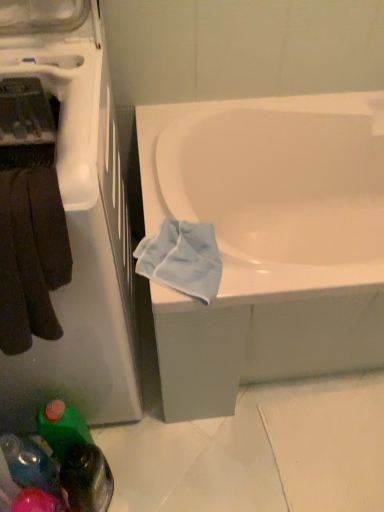
Question: Does light blue fabric at lower right have a smaller size compared to green plastic bottle at lower left, marked as the 1th bottle in a right-to-left arrangement?

Choices:
 (A) yes
 (B) no

Answer: (B)

Question: Does light blue fabric at lower right contain green plastic bottle at lower left, which appears as the second bottle when viewed from the left?

Choices:
 (A) yes
 (B) no

Answer: (B)

Question: From the image's perspective, is light blue fabric at lower right below green plastic bottle at lower left, which appears as the second bottle when viewed from the left?

Choices:
 (A) yes
 (B) no

Answer: (B)

Question: Considering the relative sizes of light blue fabric at lower right and green plastic bottle at lower left, which appears as the second bottle when viewed from the left, in the image provided, is light blue fabric at lower right wider than green plastic bottle at lower left, which appears as the second bottle when viewed from the left,?

Choices:
 (A) no
 (B) yes

Answer: (B)

Question: From a real-world perspective, is light blue fabric at lower right physically below green plastic bottle at lower left, marked as the 1th bottle in a right-to-left arrangement?

Choices:
 (A) no
 (B) yes

Answer: (A)

Question: Is point (36, 472) positioned closer to the camera than point (44, 437)?

Choices:
 (A) closer
 (B) farther

Answer: (A)

Question: Based on their sizes in the image, would you say translucent plastic bottle at lower left, marked as the 1th bottle in a left-to-right arrangement, is bigger or smaller than green plastic bottle at lower left, marked as the 1th bottle in a right-to-left arrangement?

Choices:
 (A) small
 (B) big

Answer: (A)

Question: Is translucent plastic bottle at lower left, placed as the 2th bottle when sorted from right to left, in front of or behind green plastic bottle at lower left, which appears as the second bottle when viewed from the left, in the image?

Choices:
 (A) behind
 (B) front

Answer: (B)

Question: Is translucent plastic bottle at lower left, marked as the 1th bottle in a left-to-right arrangement, to the left or to the right of green plastic bottle at lower left, marked as the 1th bottle in a right-to-left arrangement, in the image?

Choices:
 (A) left
 (B) right

Answer: (A)

Question: Which is correct: dark brown towel at left is inside white glossy dishwasher at left, or outside of it?

Choices:
 (A) outside
 (B) inside

Answer: (B)

Question: Considering the positions of dark brown towel at left and white glossy dishwasher at left in the image, is dark brown towel at left wider or thinner than white glossy dishwasher at left?

Choices:
 (A) thin
 (B) wide

Answer: (A)

Question: Relative to white glossy dishwasher at left, is dark brown towel at left in front or behind?

Choices:
 (A) behind
 (B) front

Answer: (A)

Question: In terms of height, does dark brown towel at left look taller or shorter compared to white glossy dishwasher at left?

Choices:
 (A) tall
 (B) short

Answer: (B)

Question: Is point (137, 251) positioned closer to the camera than point (254, 297)?

Choices:
 (A) farther
 (B) closer

Answer: (A)

Question: Would you say light blue fabric at lower right is to the left or to the right of white glossy bathtub at center in the picture?

Choices:
 (A) right
 (B) left

Answer: (B)